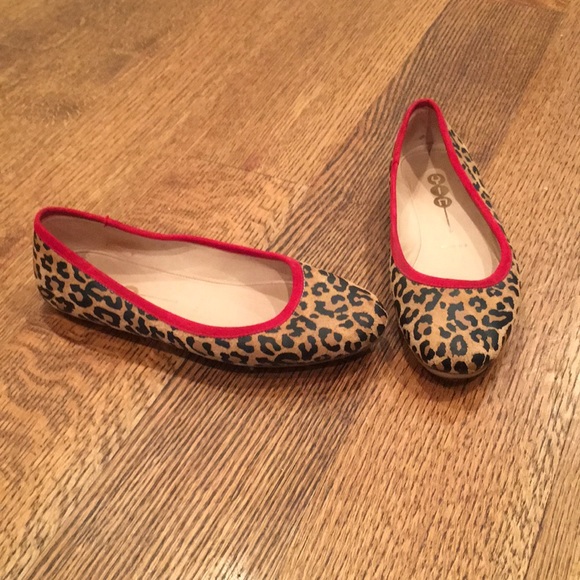
Where is `dark wood`? dark wood is located at coordinates (349, 202).